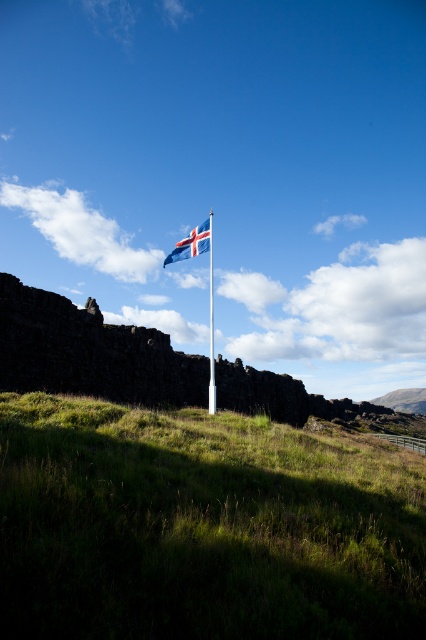
Does blue fabric flag at center have a lesser height compared to white plastic flag pole at center?

Indeed, blue fabric flag at center has a lesser height compared to white plastic flag pole at center.

Is blue fabric flag at center above white plastic flag pole at center?

Yes, blue fabric flag at center is above white plastic flag pole at center.

Who is more distant from viewer, [166,262] or [210,285]?

Point [210,285]

You are a GUI agent. You are given a task and a screenshot of the screen. Output one action in this format:
    pyautogui.click(x=<x>, y=<y>)
    Task: Click on the blue fabric flag at center
    
    Given the screenshot: What is the action you would take?
    pyautogui.click(x=192, y=243)

Can you confirm if green grassy hillside at center is wider than white plastic flag pole at center?

Indeed, green grassy hillside at center has a greater width compared to white plastic flag pole at center.

Measure the distance between green grassy hillside at center and white plastic flag pole at center.

A distance of 16.49 meters exists between green grassy hillside at center and white plastic flag pole at center.

Who is more forward, (17, 408) or (212, 330)?

Point (17, 408) is in front.

Find the location of a particular element. This screenshot has height=640, width=426. green grassy hillside at center is located at coordinates (203, 525).

Measure the distance between green grassy hillside at center and blue fabric flag at center.

They are 60.50 feet apart.

Between green grassy hillside at center and blue fabric flag at center, which one appears on the right side from the viewer's perspective?

Positioned to the right is green grassy hillside at center.

Between point (135, 461) and point (180, 252), which one is positioned in front?

Point (135, 461) is more forward.

Where is `green grassy hillside at center`? The height and width of the screenshot is (640, 426). green grassy hillside at center is located at coordinates (203, 525).